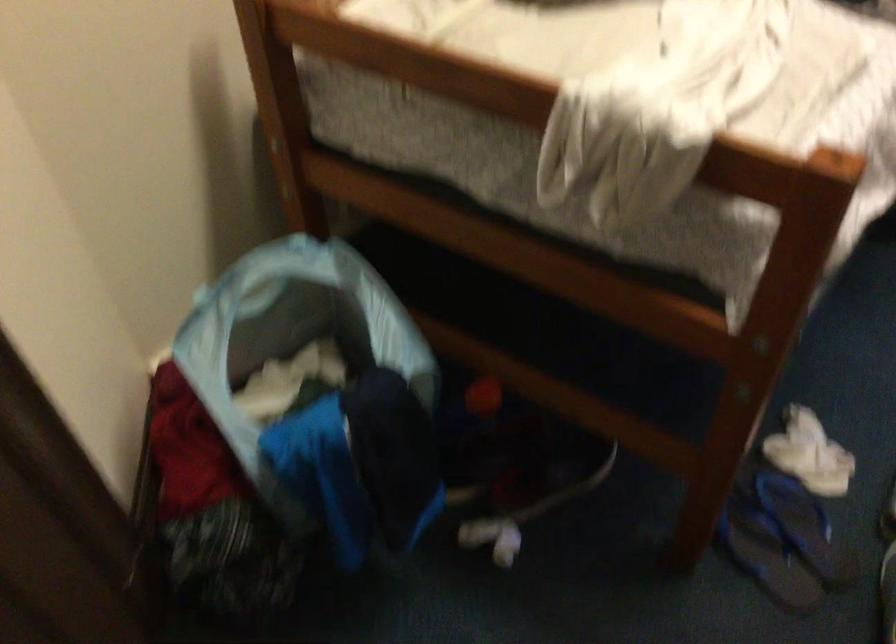
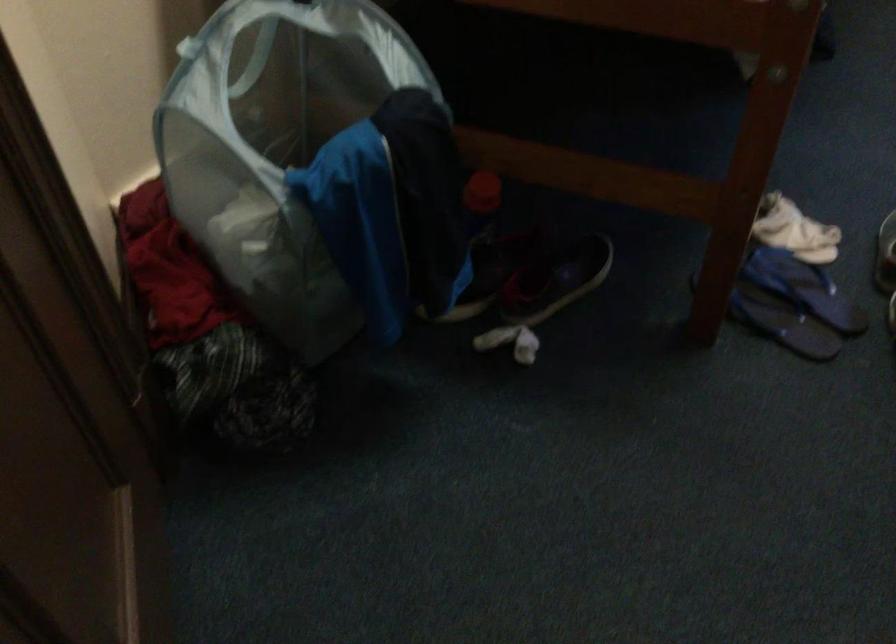
Question: The first image is from the beginning of the video and the second image is from the end. How did the camera likely rotate when shooting the video?

Choices:
 (A) Left
 (B) Right
 (C) Up
 (D) Down

Answer: (B)